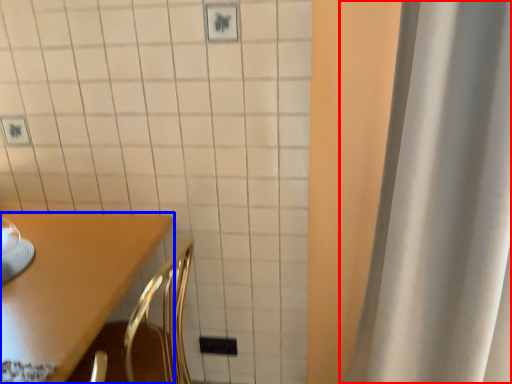
Question: Which point is further to the camera, curtain (highlighted by a red box) or furniture (highlighted by a blue box)?

Choices:
 (A) curtain
 (B) furniture

Answer: (B)